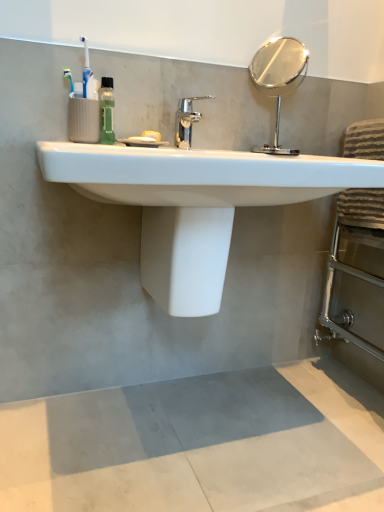
Question: Is white glossy toilet bowl at center facing away from green translucent bottle at upper left?

Choices:
 (A) no
 (B) yes

Answer: (A)

Question: Would you consider white glossy toilet bowl at center to be distant from green translucent bottle at upper left?

Choices:
 (A) yes
 (B) no

Answer: (B)

Question: Does white glossy toilet bowl at center have a greater width compared to green translucent bottle at upper left?

Choices:
 (A) yes
 (B) no

Answer: (A)

Question: Considering the relative sizes of white glossy toilet bowl at center and green translucent bottle at upper left in the image provided, is white glossy toilet bowl at center thinner than green translucent bottle at upper left?

Choices:
 (A) yes
 (B) no

Answer: (B)

Question: From the image's perspective, is white glossy toilet bowl at center located beneath green translucent bottle at upper left?

Choices:
 (A) no
 (B) yes

Answer: (B)

Question: In the image, is green translucent bottle at upper left positioned in front of or behind gray concrete mat at lower center?

Choices:
 (A) front
 (B) behind

Answer: (B)

Question: From the image's perspective, is green translucent bottle at upper left positioned above or below gray concrete mat at lower center?

Choices:
 (A) above
 (B) below

Answer: (A)

Question: Considering the relative positions of green translucent bottle at upper left and gray concrete mat at lower center in the image provided, is green translucent bottle at upper left to the left or to the right of gray concrete mat at lower center?

Choices:
 (A) right
 (B) left

Answer: (B)

Question: Based on their sizes in the image, would you say green translucent bottle at upper left is bigger or smaller than gray concrete mat at lower center?

Choices:
 (A) small
 (B) big

Answer: (A)

Question: Which is correct: polished silver mirror at upper right is inside white glossy toilet bowl at center, or outside of it?

Choices:
 (A) inside
 (B) outside

Answer: (B)

Question: From a real-world perspective, is polished silver mirror at upper right positioned above or below white glossy toilet bowl at center?

Choices:
 (A) above
 (B) below

Answer: (A)

Question: Is polished silver mirror at upper right wider or thinner than white glossy toilet bowl at center?

Choices:
 (A) thin
 (B) wide

Answer: (A)

Question: Does point (271, 68) appear closer or farther from the camera than point (216, 248)?

Choices:
 (A) closer
 (B) farther

Answer: (B)

Question: In terms of height, does polished silver mirror at upper right look taller or shorter compared to white glossy sink at center?

Choices:
 (A) short
 (B) tall

Answer: (B)

Question: Relative to white glossy sink at center, is polished silver mirror at upper right in front or behind?

Choices:
 (A) behind
 (B) front

Answer: (A)